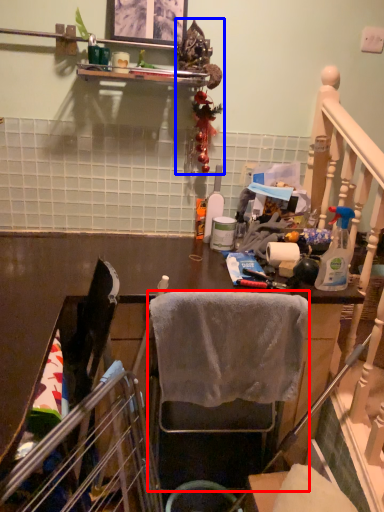
Question: Among these objects, which one is farthest to the camera, chair (highlighted by a red box) or christmas decoration (highlighted by a blue box)?

Choices:
 (A) chair
 (B) christmas decoration

Answer: (B)